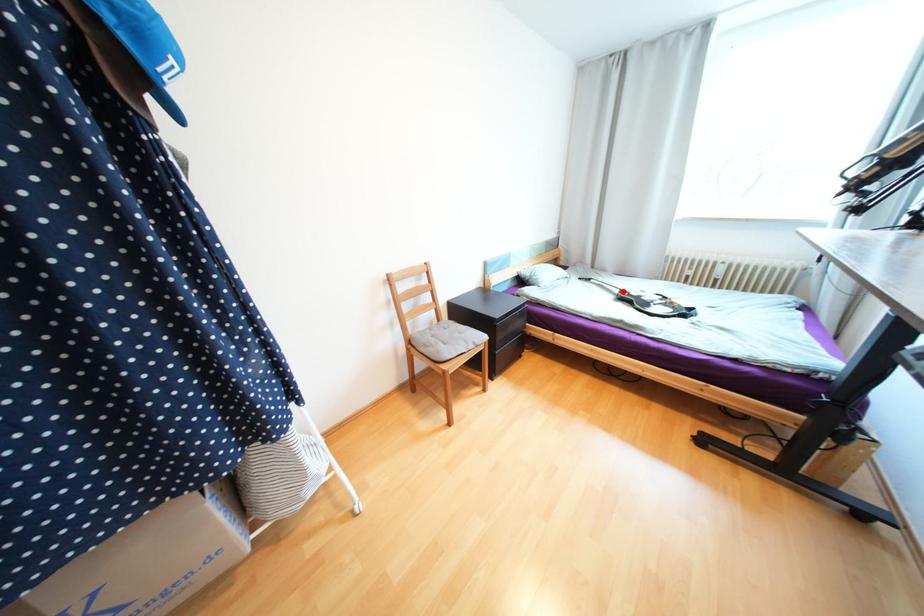
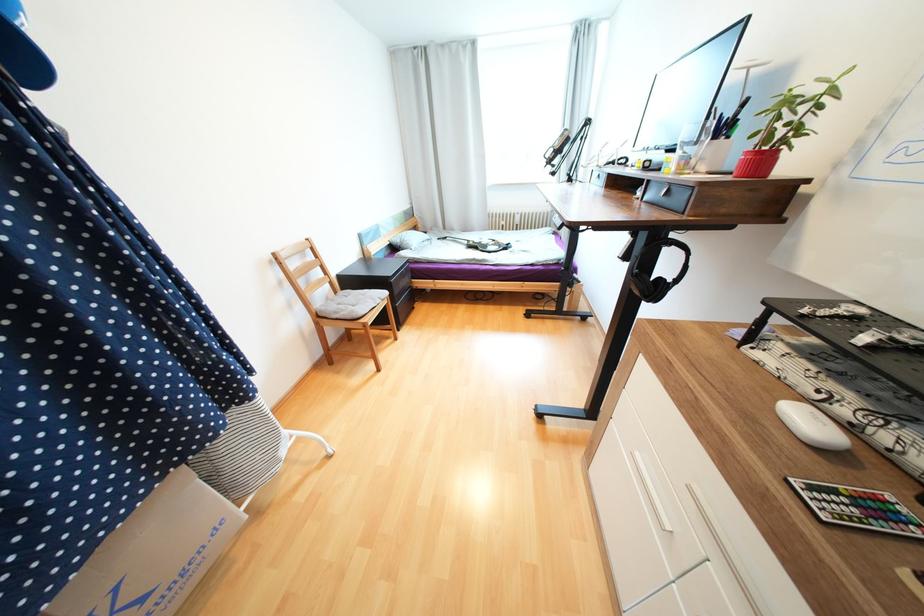
Locate, in the second image, the point that corresponds to the highlighted location in the first image.

(471, 243)